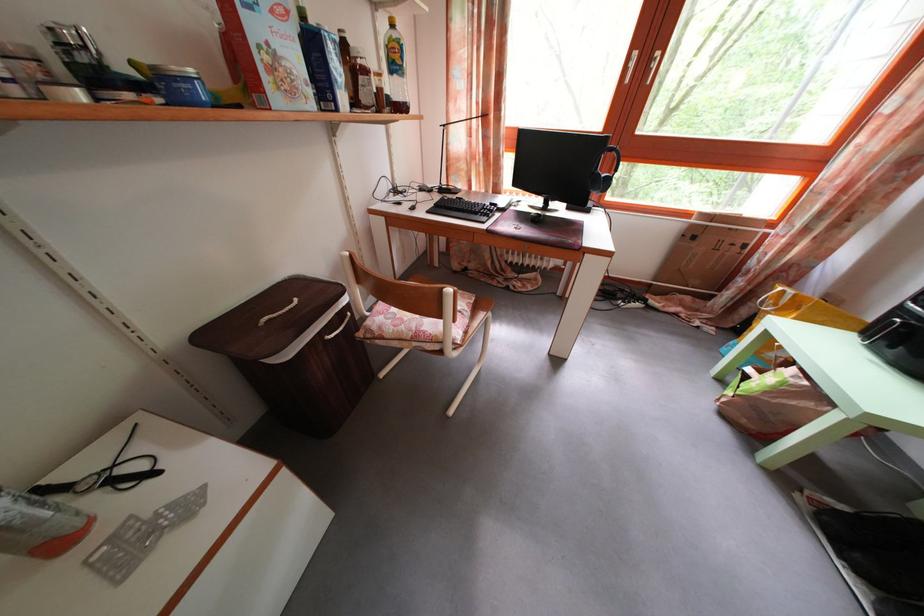
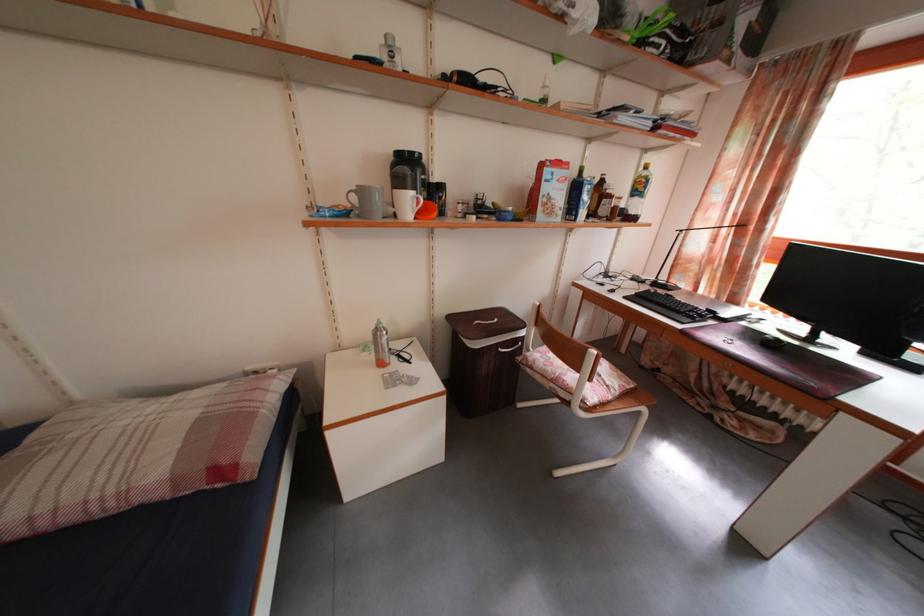
Locate, in the second image, the point that corresponds to (x=453, y=188) in the first image.

(671, 285)